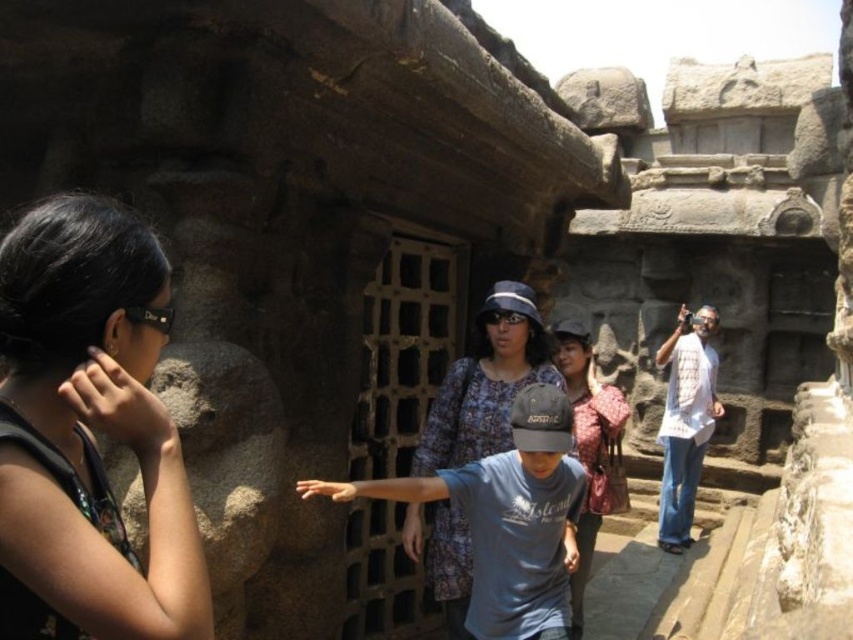
Where is `white woven shirt at right`? white woven shirt at right is located at coordinates (685, 420).

Between point (701, 406) and point (602, 486), which one is positioned in front?

Point (602, 486) is in front.

Is point (672, 424) farther from viewer compared to point (589, 339)?

Yes, point (672, 424) is farther from viewer.

Where is `white woven shirt at right`? The width and height of the screenshot is (853, 640). white woven shirt at right is located at coordinates (685, 420).

Is printed fabric dress at center positioned behind white woven shirt at right?

No, printed fabric dress at center is closer to the viewer.

Find the location of a particular element. Image resolution: width=853 pixels, height=640 pixels. printed fabric dress at center is located at coordinates (486, 381).

Find the location of `printed fabric dress at center`. printed fabric dress at center is located at coordinates (486, 381).

Can you confirm if black matte sunglasses at left is taller than printed fabric dress at center?

In fact, black matte sunglasses at left may be shorter than printed fabric dress at center.

In the scene shown: Does black matte sunglasses at left appear under printed fabric dress at center?

Incorrect, black matte sunglasses at left is not positioned below printed fabric dress at center.

Find the location of `black matte sunglasses at left`. black matte sunglasses at left is located at coordinates (90, 433).